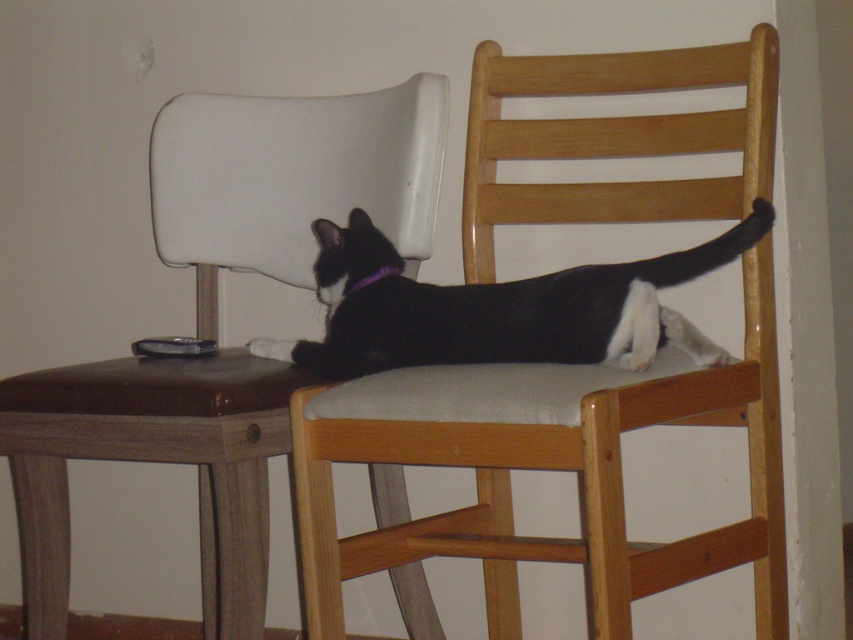
You are a GUI agent. You are given a task and a screenshot of the screen. Output one action in this format:
    pyautogui.click(x=<x>, y=<y>)
    Task: Click on the black matte fur cat at center
    The image size is (853, 640).
    Given the screenshot: What is the action you would take?
    (x=500, y=308)

Is point (762, 228) positioned in front of point (345, 292)?

That is True.

Find the location of `black matte fur cat at center`. black matte fur cat at center is located at coordinates (500, 308).

Between point (323, 428) and point (384, 269), which one is positioned behind?

The point (384, 269) is behind.

Who is positioned more to the left, wooden chair at center or purple fabric neckband at center?

From the viewer's perspective, purple fabric neckband at center appears more on the left side.

You are a GUI agent. You are given a task and a screenshot of the screen. Output one action in this format:
    pyautogui.click(x=<x>, y=<y>)
    Task: Click on the wooden chair at center
    The image size is (853, 640).
    Given the screenshot: What is the action you would take?
    pyautogui.click(x=544, y=468)

Find the location of a particular element. The image size is (853, 640). wooden chair at center is located at coordinates (544, 468).

Locate an element on the screen. Image resolution: width=853 pixels, height=640 pixels. white leather chair at upper left is located at coordinates (291, 179).

Can you confirm if white leather chair at upper left is positioned below satin black remote at upper left?

Actually, white leather chair at upper left is above satin black remote at upper left.

Does point (181, 392) come behind point (186, 339)?

No, (181, 392) is closer to viewer.

You are a GUI agent. You are given a task and a screenshot of the screen. Output one action in this format:
    pyautogui.click(x=<x>, y=<y>)
    Task: Click on the white leather chair at upper left
    This screenshot has width=853, height=640.
    Given the screenshot: What is the action you would take?
    pyautogui.click(x=291, y=179)